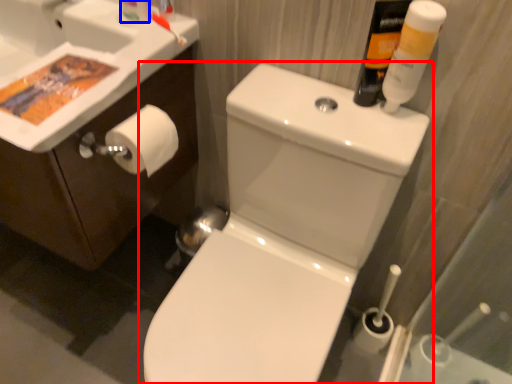
Question: Which of the following is the farthest to the observer, toilet (highlighted by a red box) or toiletry (highlighted by a blue box)?

Choices:
 (A) toilet
 (B) toiletry

Answer: (B)